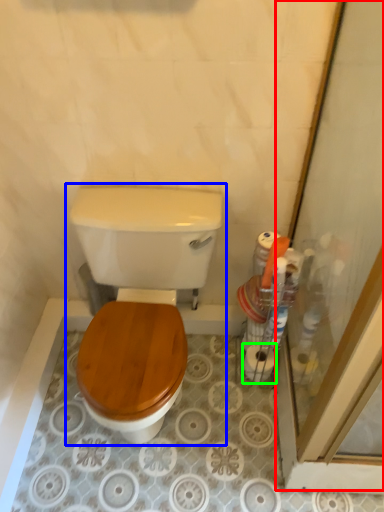
Question: Based on their relative distances, which object is farther from screen door (highlighted by a red box)? Choose from toilet (highlighted by a blue box) and toilet paper (highlighted by a green box).

Choices:
 (A) toilet
 (B) toilet paper

Answer: (A)